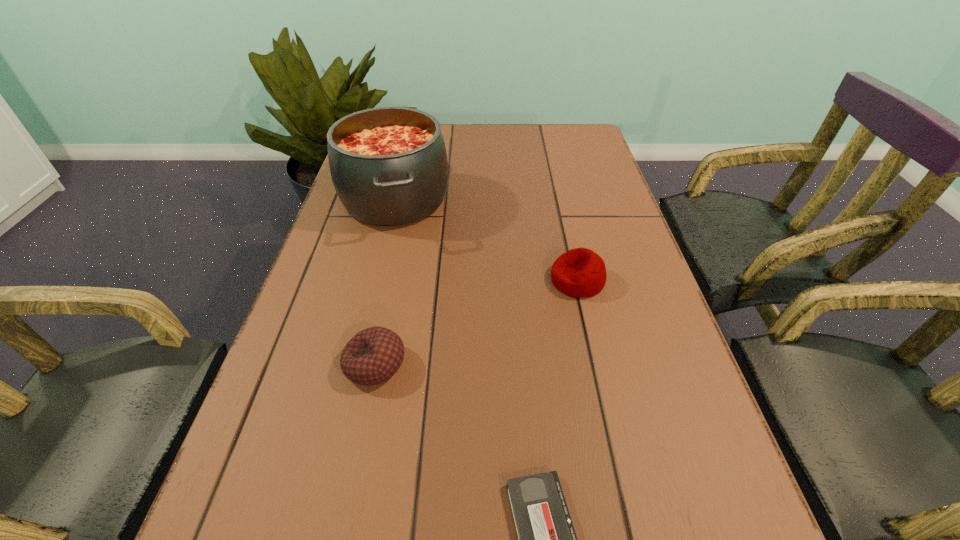
Identify the location of free point between the farther beanbag and the left beanbag. This screenshot has height=540, width=960. (476, 322).

The image size is (960, 540). In order to click on free space that is in between the casserole and the left beanbag in this screenshot , I will do 385,282.

At what (x,y) coordinates should I click in order to perform the action: click on free space between the right beanbag and the nearer beanbag. Please return your answer as a coordinate pair (x, y). This screenshot has height=540, width=960. Looking at the image, I should click on (476, 322).

Find the location of a particular element. The image size is (960, 540). free spot between the casserole and the left beanbag is located at coordinates (385, 282).

This screenshot has width=960, height=540. Identify the location of object that can be found as the second closest to the third farthest object. (389, 167).

Point out which object is positioned as the nearest to the tallest object. Please provide its 2D coordinates. Your answer should be formatted as a tuple, i.e. [(x, y)], where the tuple contains the x and y coordinates of a point satisfying the conditions above.

[(579, 273)]